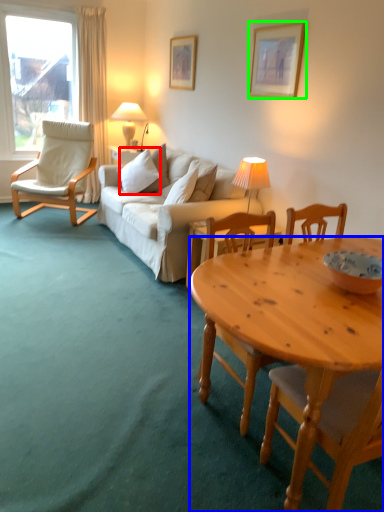
Question: Which is nearer to the pillow (highlighted by a red box)? desk (highlighted by a blue box) or picture frame (highlighted by a green box).

Choices:
 (A) desk
 (B) picture frame

Answer: (B)